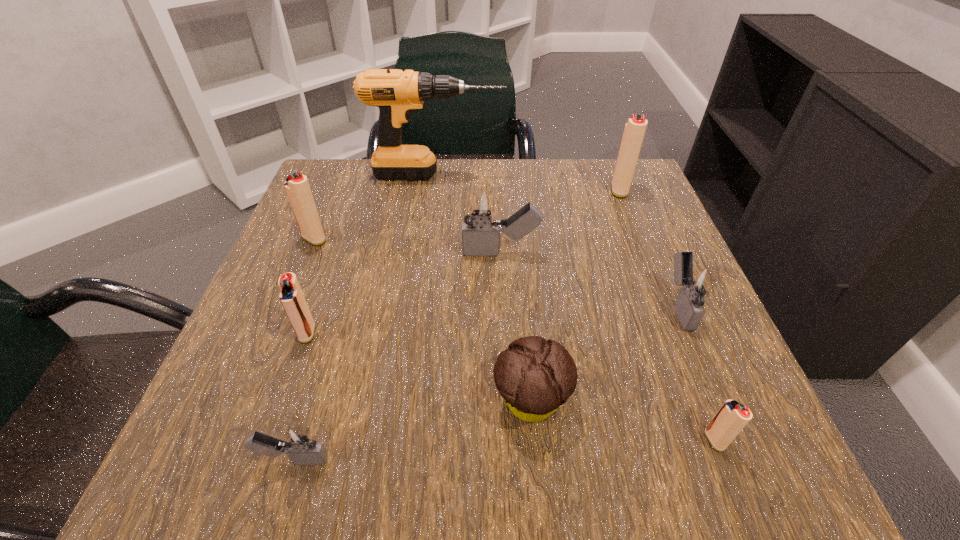
Identify the location of object situated at the far right corner. The width and height of the screenshot is (960, 540). (x=635, y=128).

You are a GUI agent. You are given a task and a screenshot of the screen. Output one action in this format:
    pyautogui.click(x=<x>, y=<y>)
    Task: Click on the object that is at the near right corner
    The height and width of the screenshot is (540, 960).
    Given the screenshot: What is the action you would take?
    pyautogui.click(x=732, y=417)

Find the location of a particular element. The height and width of the screenshot is (540, 960). vacant space at the far edge of the desktop is located at coordinates [x=428, y=208].

At what (x,y) coordinates should I click in order to perform the action: click on free space at the near edge. Please return your answer as a coordinate pair (x, y). The image size is (960, 540). Looking at the image, I should click on (401, 437).

I want to click on free space at the left edge of the desktop, so tap(247, 334).

In the image, there is a desktop. At what (x,y) coordinates should I click in order to perform the action: click on vacant space at the right edge. Please return your answer as a coordinate pair (x, y). The height and width of the screenshot is (540, 960). Looking at the image, I should click on (639, 314).

At what (x,y) coordinates should I click in order to perform the action: click on vacant space at the far left corner. Please return your answer as a coordinate pair (x, y). This screenshot has width=960, height=540. Looking at the image, I should click on (349, 171).

Locate an element on the screen. The height and width of the screenshot is (540, 960). vacant space at the near right corner of the desktop is located at coordinates (694, 472).

The width and height of the screenshot is (960, 540). Identify the location of free space between the fourth igniter from left to right and the nearest red igniter. (608, 346).

Find the location of `vacant area that lies between the chocolate muffin and the smallest red igniter`. vacant area that lies between the chocolate muffin and the smallest red igniter is located at coordinates (623, 421).